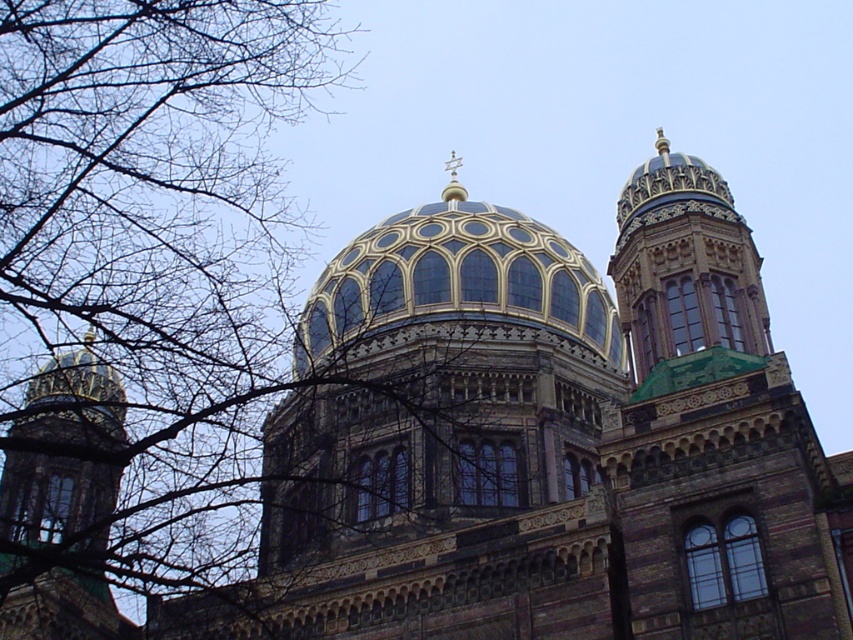
Does point (148, 497) come behind point (395, 320)?

Yes, it is behind point (395, 320).

Who is shorter, bare branches at upper left or blue glass dome at center?

blue glass dome at center

At what (x,y) coordinates should I click in order to perform the action: click on bare branches at upper left. Please return your answer as a coordinate pair (x, y). Looking at the image, I should click on (148, 268).

Is blue glass dome at center taller than gold-gilded dome at center?

Indeed, blue glass dome at center has a greater height compared to gold-gilded dome at center.

Between blue glass dome at center and gold-gilded dome at center, which one has less height?

Standing shorter between the two is gold-gilded dome at center.

Where is `blue glass dome at center`? This screenshot has width=853, height=640. blue glass dome at center is located at coordinates pos(457,276).

Does point (32, 468) come in front of point (692, 356)?

No, it is not.

Is bare branches at upper left positioned behind shiny gold dome at upper right?

No.

At what (x,y) coordinates should I click in order to perform the action: click on bare branches at upper left. Please return your answer as a coordinate pair (x, y). Image resolution: width=853 pixels, height=640 pixels. Looking at the image, I should click on (148, 268).